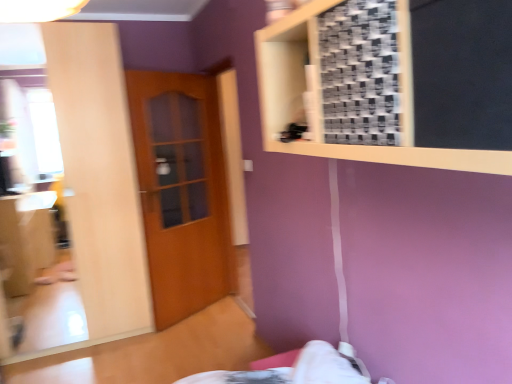
Question: Is wooden door at center taller or shorter than wooden frame at upper right?

Choices:
 (A) short
 (B) tall

Answer: (B)

Question: Does point (180, 278) appear closer or farther from the camera than point (269, 127)?

Choices:
 (A) farther
 (B) closer

Answer: (A)

Question: Considering the real-world distances, which object is closest to the matte wooden mirror at left?

Choices:
 (A) wooden frame at upper right
 (B) wooden door at center

Answer: (B)

Question: Which of these objects is positioned farthest from the matte wooden mirror at left?

Choices:
 (A) wooden frame at upper right
 (B) wooden door at center

Answer: (A)